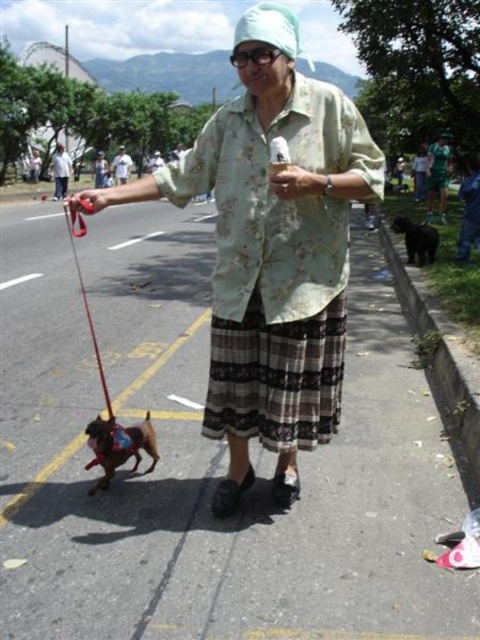
Is brown leather dog at lower left positioned at the back of rubber leash at left?

Yes, it is.

Where is `brown leather dog at lower left`? The width and height of the screenshot is (480, 640). brown leather dog at lower left is located at coordinates (119, 445).

Identify the location of brown leather dog at lower left. The image size is (480, 640). (119, 445).

Is smooth asphalt road at center positioned before plaid fabric skirt at center?

Yes, smooth asphalt road at center is closer to the viewer.

Does smooth asphalt road at center appear over plaid fabric skirt at center?

Yes.

Looking at this image, who is more distant from viewer, (385, 456) or (247, 332)?

The point (385, 456) is behind.

This screenshot has height=640, width=480. Find the location of `smooth asphalt road at center`. smooth asphalt road at center is located at coordinates (205, 458).

Is the position of smooth asphalt road at center more distant than that of floral fabric shirt at center?

No, smooth asphalt road at center is in front of floral fabric shirt at center.

Is smooth asphalt road at center shorter than floral fabric shirt at center?

No.

This screenshot has height=640, width=480. I want to click on smooth asphalt road at center, so click(x=205, y=458).